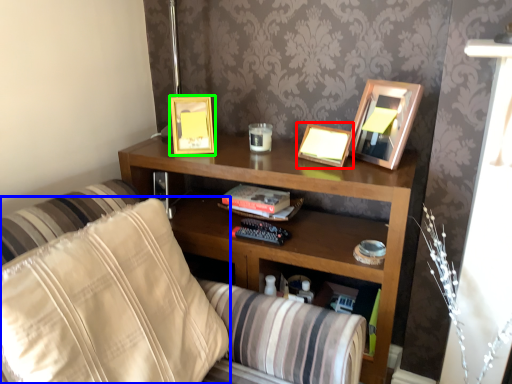
Question: Which is farther away from picture frame (highlighted by a red box)? pillow (highlighted by a blue box) or picture frame (highlighted by a green box)?

Choices:
 (A) pillow
 (B) picture frame

Answer: (A)